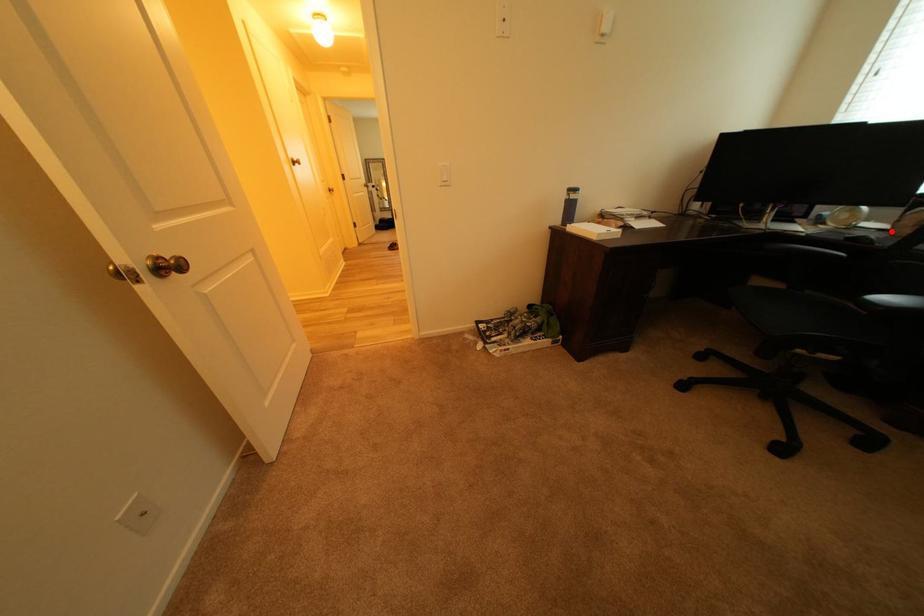
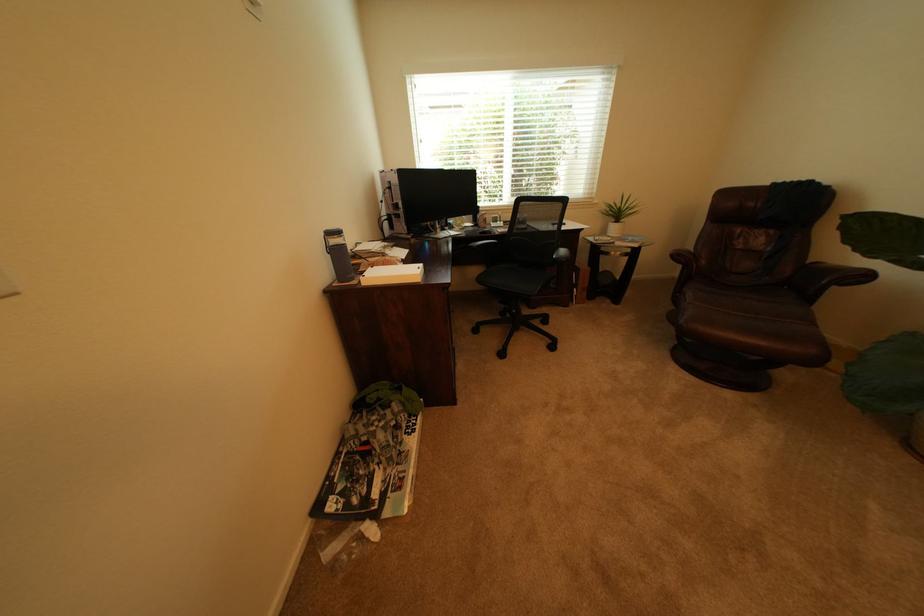
Question: I am providing you with two images of the same scene from different viewpoints. In image1, a red point is highlighted. Considering the same 3D point in image2, which of the following is correct?

Choices:
 (A) It is closer
 (B) It is farther

Answer: (A)